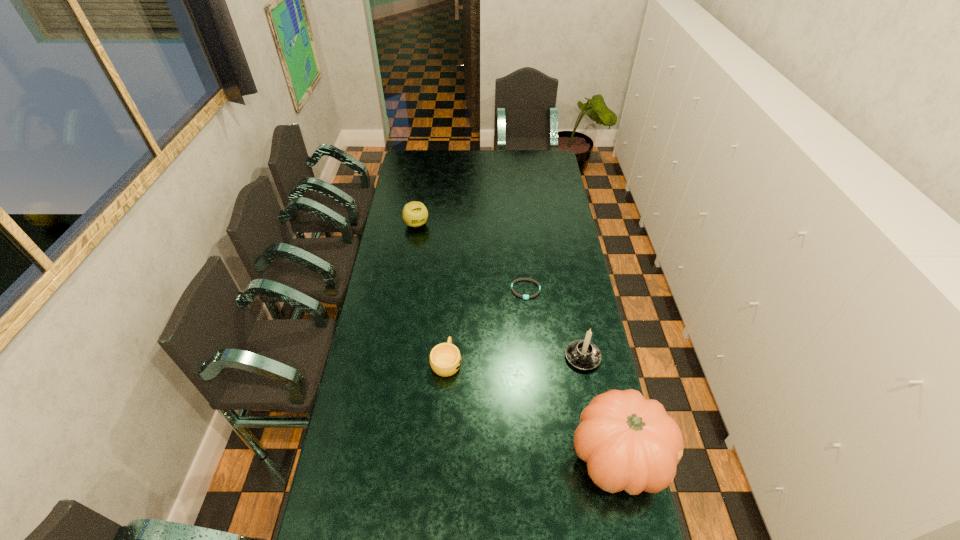
Find the location of a particular element. This screenshot has width=960, height=540. free point that satisfies the following two spatial constraints: 1. on the back side of the fourth shortest object; 2. on the left side of the fourth object from right to left is located at coordinates (446, 357).

I want to click on vacant area that satisfies the following two spatial constraints: 1. on the front side of the tallest object; 2. on the carved face of the cup, so coord(441,456).